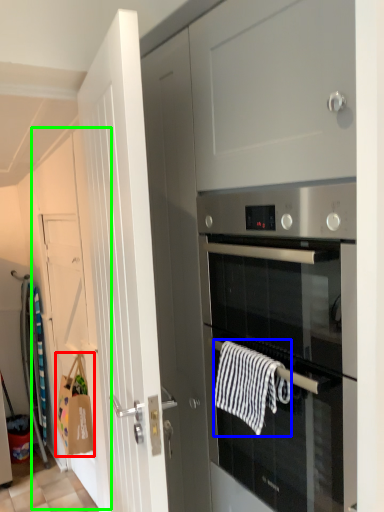
Question: Which object is positioned closest to hand towel (highlighted by a red box)? Select from hand towel (highlighted by a blue box) and door (highlighted by a green box).

Choices:
 (A) hand towel
 (B) door

Answer: (B)